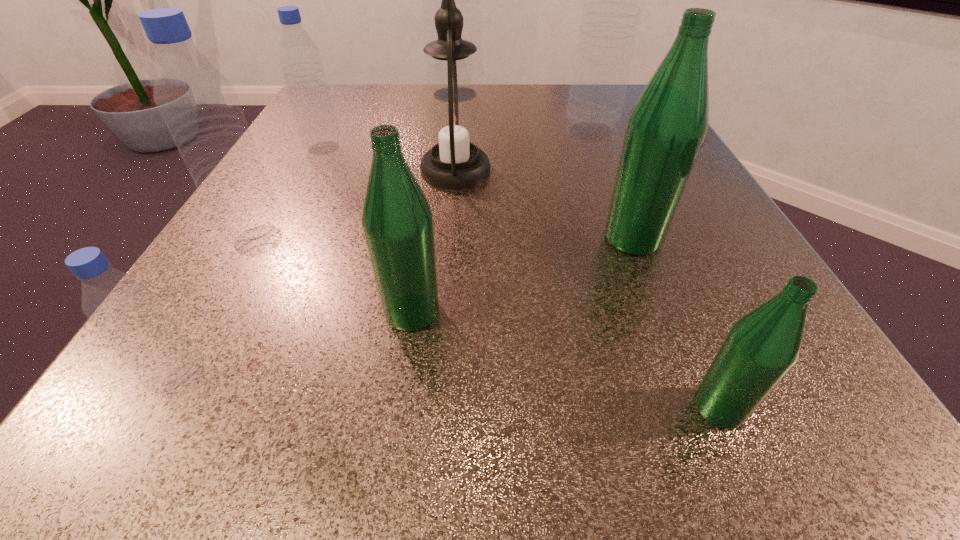
I want to click on the fourth blue bottle from left to right, so click(468, 0).

I want to click on the farthest blue bottle, so click(468, 0).

Find the location of a particular element. The image size is (960, 540). the rightmost blue bottle is located at coordinates (613, 3).

Locate an element on the screen. Image resolution: width=960 pixels, height=540 pixels. the seventh shortest bottle is located at coordinates (613, 3).

The height and width of the screenshot is (540, 960). In order to click on oil lamp in this screenshot , I will do `click(452, 116)`.

Identify the location of the third biggest blue bottle. (198, 104).

You are a GUI agent. You are given a task and a screenshot of the screen. Output one action in this format:
    pyautogui.click(x=<x>, y=<y>)
    Task: Click on the biggest green bottle
    
    Given the screenshot: What is the action you would take?
    pyautogui.click(x=666, y=127)

I want to click on the second smallest blue bottle, so click(302, 66).

You are a GUI agent. You are given a task and a screenshot of the screen. Output one action in this format:
    pyautogui.click(x=<x>, y=<y>)
    Task: Click on the seventh farthest object
    
    Given the screenshot: What is the action you would take?
    pyautogui.click(x=397, y=222)

Locate an element on the screen. The image size is (960, 540). the second farthest green bottle is located at coordinates (397, 222).